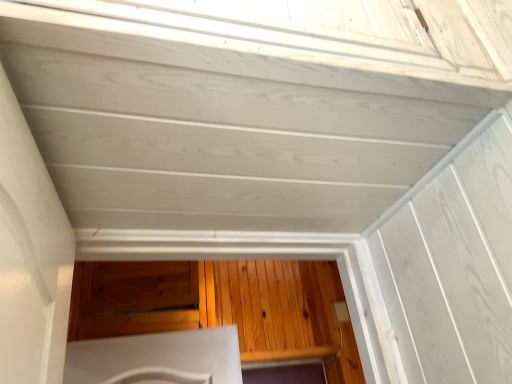
Image resolution: width=512 pixels, height=384 pixels. What do you see at coordinates (134, 298) in the screenshot?
I see `wooden cabinet at center` at bounding box center [134, 298].

What is the approximate width of wooden cabinet at center?

29.11 inches.

Where is `wooden cabinet at center`? wooden cabinet at center is located at coordinates (134, 298).

Locate an element on the screen. Image resolution: width=512 pixels, height=384 pixels. wooden cabinet at center is located at coordinates (134, 298).